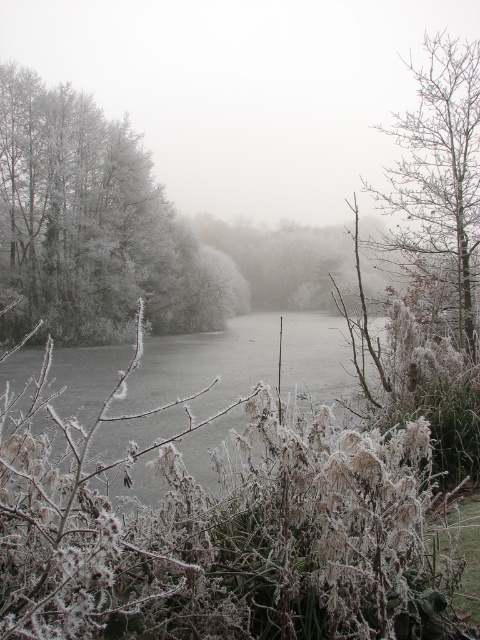
Question: Which of the following is the closest to the observer?

Choices:
 (A) (135, 134)
 (B) (62, 368)

Answer: (B)

Question: Which of the following is the closest to the observer?

Choices:
 (A) (10, 228)
 (B) (452, 209)
 (C) (86, 380)

Answer: (B)

Question: Is frosted white trees at left positioned at the back of frosty bark tree at right?

Choices:
 (A) yes
 (B) no

Answer: (A)

Question: Which point is closer to the camera?

Choices:
 (A) frosted white trees at left
 (B) frosted ice at center
 (C) frosty bark tree at right

Answer: (B)

Question: Is frosted white trees at left smaller than frosty bark tree at right?

Choices:
 (A) no
 (B) yes

Answer: (B)

Question: Where is frosted white trees at left located in relation to frosted ice at center in the image?

Choices:
 (A) above
 (B) below

Answer: (A)